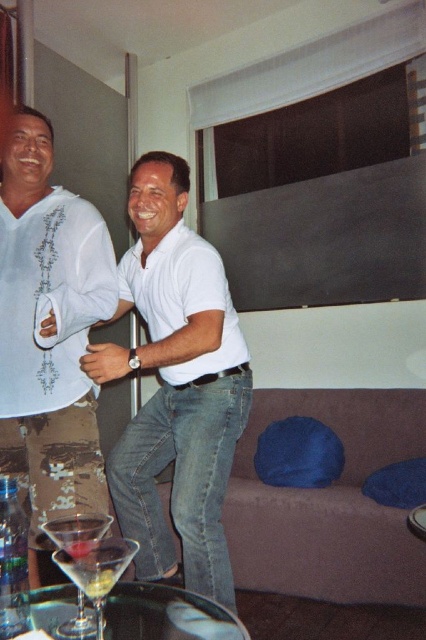
Does white matte shirt at center have a smaller size compared to clear glass wine glass at lower left?

Incorrect, white matte shirt at center is not smaller in size than clear glass wine glass at lower left.

Is white matte shirt at center shorter than clear glass wine glass at lower left?

In fact, white matte shirt at center may be taller than clear glass wine glass at lower left.

What do you see at coordinates (176, 385) in the screenshot?
I see `white matte shirt at center` at bounding box center [176, 385].

Find the location of a particular element. This screenshot has height=640, width=426. white matte shirt at center is located at coordinates (176, 385).

Is transparent glass table at lower center further to the viewer compared to clear glass wine glass at lower left?

Yes.

Identify the location of transparent glass table at lower center. The width and height of the screenshot is (426, 640). (166, 614).

Is white embroidered shirt at left bigger than brown suede couch at lower center?

No.

Between point (23, 266) and point (256, 552), which one is positioned behind?

Positioned behind is point (256, 552).

Image resolution: width=426 pixels, height=640 pixels. I want to click on white embroidered shirt at left, so click(49, 330).